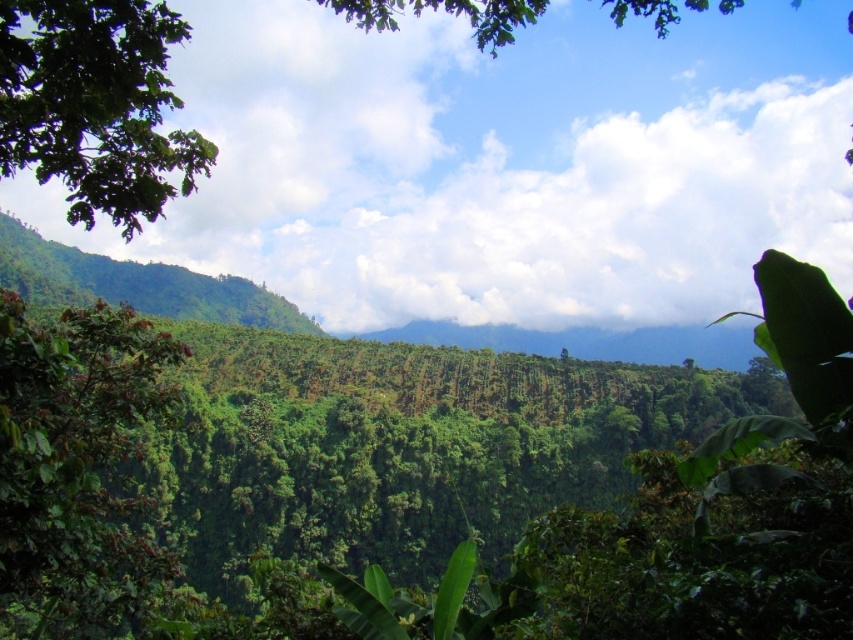
Does green leafy tree at left have a greater height compared to green leafy tree at upper left?

No, green leafy tree at left is not taller than green leafy tree at upper left.

Between point (45, 560) and point (13, 96), which one is positioned behind?

The point (45, 560) is more distant.

Where is `green leafy tree at left`? The image size is (853, 640). green leafy tree at left is located at coordinates (74, 467).